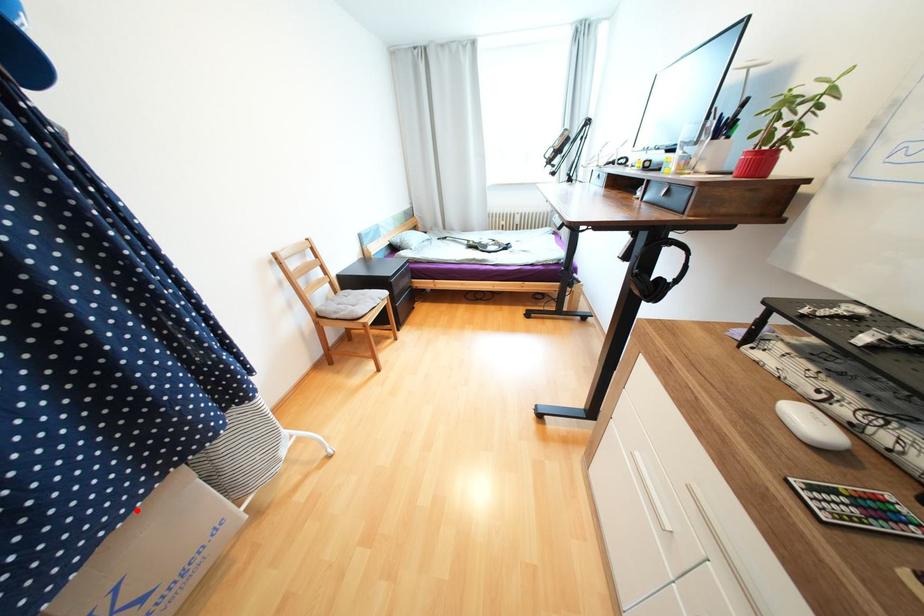
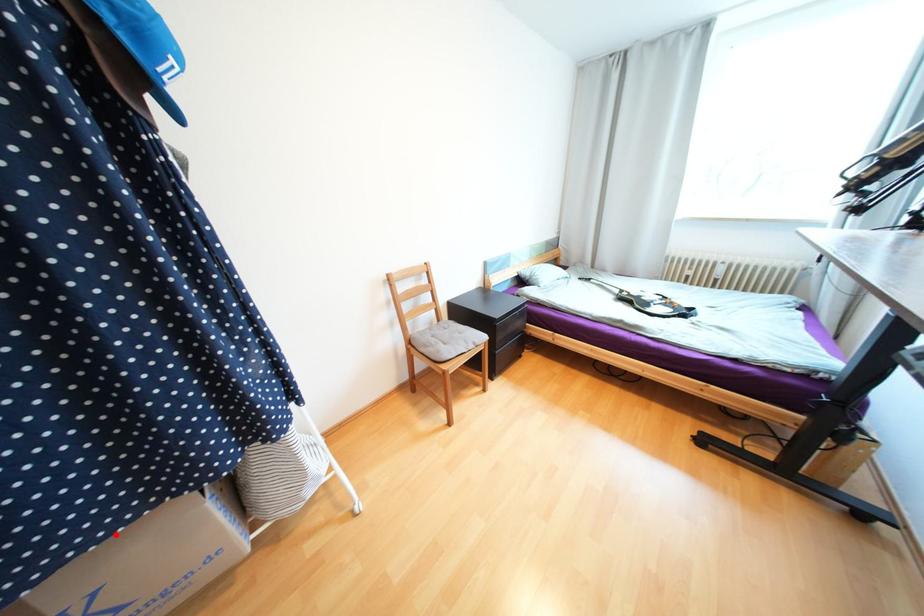
I am providing you with two images of the same scene from different viewpoints. A red point is marked on the first image and another point is marked on the second image. Do the highlighted points in image1 and image2 indicate the same real-world spot?

Yes